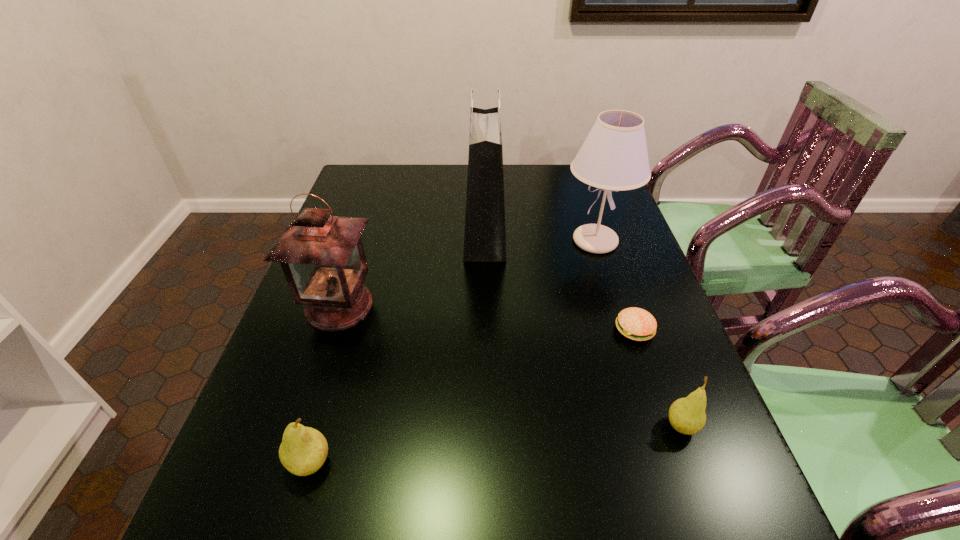
I want to click on vacant region located 0.190m on the front of the lampshade, so click(x=618, y=313).

Image resolution: width=960 pixels, height=540 pixels. What are the coordinates of `vacant space located on the front with handles of the fourth object from right to left` in the screenshot? It's located at (424, 232).

The height and width of the screenshot is (540, 960). I want to click on vacant position located 0.300m on the front with handles of the fourth object from right to left, so click(x=366, y=232).

Locate an element on the screen. Image resolution: width=960 pixels, height=540 pixels. free spot located on the front with handles of the fourth object from right to left is located at coordinates (362, 232).

This screenshot has width=960, height=540. In order to click on vacant space located 0.160m on the left of the patty in this screenshot , I will do `click(547, 330)`.

Identify the location of vacant space situated on the back of the oil lamp. (363, 233).

At what (x,y) coordinates should I click in order to perform the action: click on pear present at the left edge. Please return your answer as a coordinate pair (x, y). The image size is (960, 540). Looking at the image, I should click on (303, 450).

Where is `oil lamp at the left edge`? oil lamp at the left edge is located at coordinates (322, 256).

This screenshot has width=960, height=540. I want to click on pear located in the right edge section of the desktop, so [687, 415].

This screenshot has width=960, height=540. Identify the location of lampshade located in the right edge section of the desktop. (613, 157).